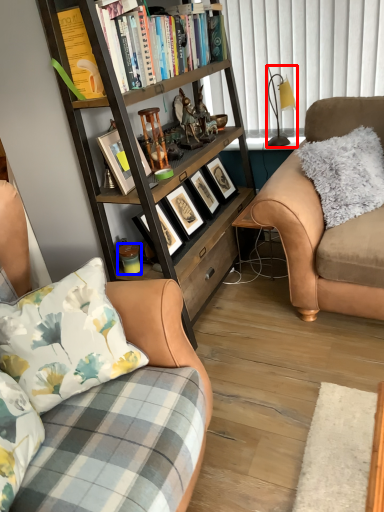
Question: Which of the following is the farthest to the observer, lamp (highlighted by a red box) or coffee cup (highlighted by a blue box)?

Choices:
 (A) lamp
 (B) coffee cup

Answer: (A)